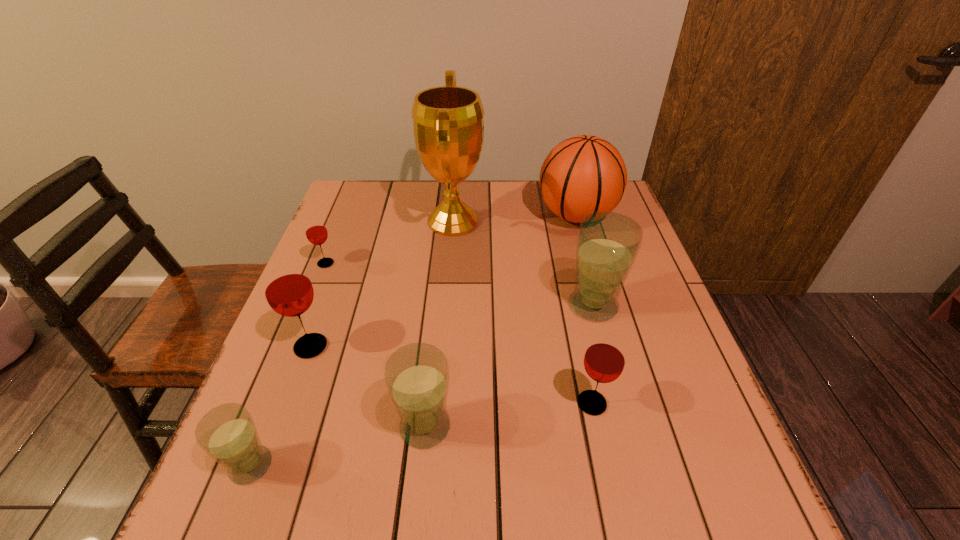
You are a GUI agent. You are given a task and a screenshot of the screen. Output one action in this format:
    pyautogui.click(x=<x>, y=<y>)
    Task: Click on the free region located on the back of the farthest glass
    
    Given the screenshot: What is the action you would take?
    pyautogui.click(x=348, y=208)

Locate an element on the screen. The height and width of the screenshot is (540, 960). free space located on the back of the smallest blue glass is located at coordinates (300, 341).

Locate an element on the screen. The width and height of the screenshot is (960, 540). award situated at the far edge is located at coordinates (448, 124).

Image resolution: width=960 pixels, height=540 pixels. I want to click on basketball present at the far edge, so coord(584,174).

Locate an element on the screen. object that is at the near edge is located at coordinates (227, 433).

The width and height of the screenshot is (960, 540). Find the location of `basketball present at the right edge`. basketball present at the right edge is located at coordinates (584, 174).

You are a GUI agent. You are given a task and a screenshot of the screen. Output one action in this format:
    pyautogui.click(x=<x>, y=<y>)
    Task: Click on the glass located in the right edge section of the desktop
    
    Given the screenshot: What is the action you would take?
    pyautogui.click(x=608, y=243)

Identify the location of object that is at the near left corner. (227, 433).

Image resolution: width=960 pixels, height=540 pixels. Identify the location of object present at the far right corner. (584, 174).

What are the coordinates of `free region at the far edge of the desktop` in the screenshot? It's located at (419, 199).